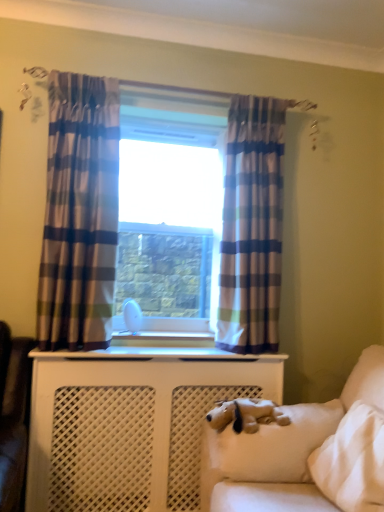
Question: From a real-world perspective, is clear glass window at center physically located above or below white glossy radiator at center?

Choices:
 (A) above
 (B) below

Answer: (A)

Question: From the image's perspective, relative to white glossy radiator at center, is clear glass window at center above or below?

Choices:
 (A) above
 (B) below

Answer: (A)

Question: Which object is positioned closest to the white plush dog at lower right?

Choices:
 (A) clear glass window at center
 (B) white glossy radiator at center
 (C) brown plush dog at lower right
 (D) white soft pillow at lower right
 (E) blue plaid curtain at center, the 1th curtain in the right-to-left sequence

Answer: (D)

Question: Considering the real-world distances, which object is closest to the blue plaid curtain at center, which ranks as the 2th curtain in left-to-right order?

Choices:
 (A) brown plush dog at lower right
 (B) white plush dog at lower right
 (C) white soft pillow at lower right
 (D) plaid fabric curtain at left, which ranks as the 2th curtain in right-to-left order
 (E) clear glass window at center

Answer: (E)